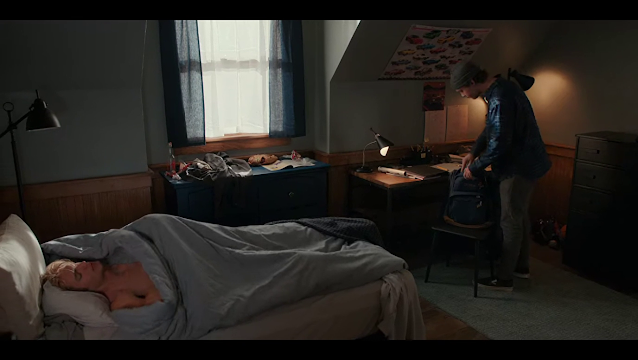
Identify the location of curtain. (214, 130).